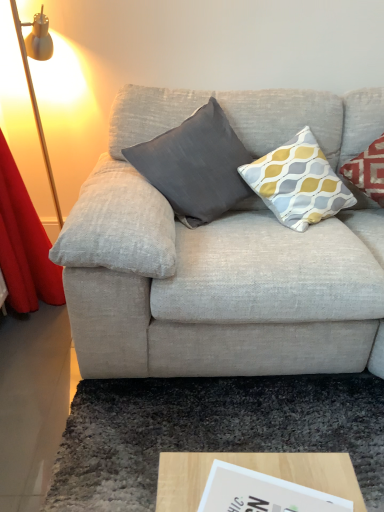
Locate an element on the screen. yellow-grey-patterned cushion at upper right, which is counted as the 1th pillow, starting from the right is located at coordinates (298, 183).

Where is `dark gray shaggy rug at lower center`? dark gray shaggy rug at lower center is located at coordinates (210, 431).

This screenshot has height=512, width=384. Identify the location of wooden at lower center. (256, 470).

Identify the location of gold metallic floor lamp at left. The width and height of the screenshot is (384, 512). (32, 81).

Can you tell me how much gold metallic floor lamp at left and dark gray shaggy rug at lower center differ in facing direction?

gold metallic floor lamp at left and dark gray shaggy rug at lower center are facing 178 degrees away from each other.

Which object is positioned more to the left, gold metallic floor lamp at left or dark gray shaggy rug at lower center?

Positioned to the left is gold metallic floor lamp at left.

Which point is more forward, [14,12] or [292,412]?

The point [292,412] is in front.

Can you confirm if gold metallic floor lamp at left is bigger than dark gray shaggy rug at lower center?

Correct, gold metallic floor lamp at left is larger in size than dark gray shaggy rug at lower center.

Considering the relative positions of dark gray fabric pillow at center, the 2th pillow from the right, and dark gray shaggy rug at lower center in the image provided, is dark gray fabric pillow at center, the 2th pillow from the right, to the right of dark gray shaggy rug at lower center from the viewer's perspective?

In fact, dark gray fabric pillow at center, the 2th pillow from the right, is to the left of dark gray shaggy rug at lower center.

Does dark gray fabric pillow at center, the 2th pillow from the right, turn towards dark gray shaggy rug at lower center?

No, dark gray fabric pillow at center, the 2th pillow from the right, is not oriented towards dark gray shaggy rug at lower center.

Is point (209, 125) positioned after point (264, 422)?

Yes, point (209, 125) is farther from viewer.

Considering the relative sizes of dark gray fabric pillow at center, the 1th pillow positioned from the left, and dark gray shaggy rug at lower center in the image provided, is dark gray fabric pillow at center, the 1th pillow positioned from the left, shorter than dark gray shaggy rug at lower center?

No, dark gray fabric pillow at center, the 1th pillow positioned from the left, is not shorter than dark gray shaggy rug at lower center.

From the image's perspective, is yellow-grey-patterned cushion at upper right, placed as the second pillow when sorted from left to right, over dark gray fabric pillow at center, the 2th pillow from the right?

No, from the image's perspective, yellow-grey-patterned cushion at upper right, placed as the second pillow when sorted from left to right, is not on top of dark gray fabric pillow at center, the 2th pillow from the right.

Which object is positioned more to the right, yellow-grey-patterned cushion at upper right, which is counted as the 1th pillow, starting from the right, or dark gray fabric pillow at center, the 2th pillow from the right?

yellow-grey-patterned cushion at upper right, which is counted as the 1th pillow, starting from the right, is more to the right.

Locate an element on the screen. pillow in front of the dark gray fabric pillow at center, the 2th pillow from the right is located at coordinates (298, 183).

From the picture: Considering their positions, is yellow-grey-patterned cushion at upper right, which is counted as the 1th pillow, starting from the right, located in front of or behind dark gray fabric pillow at center, the 1th pillow positioned from the left?

Visually, yellow-grey-patterned cushion at upper right, which is counted as the 1th pillow, starting from the right, is located in front of dark gray fabric pillow at center, the 1th pillow positioned from the left.

Based on the photo, what's the angular difference between dark gray fabric pillow at center, the 1th pillow positioned from the left, and wooden at lower center's facing directions?

The angle between the facing direction of dark gray fabric pillow at center, the 1th pillow positioned from the left, and the facing direction of wooden at lower center is 16.7 degrees.

Choose the correct answer: Is dark gray fabric pillow at center, the 1th pillow positioned from the left, inside wooden at lower center or outside it?

dark gray fabric pillow at center, the 1th pillow positioned from the left, is spatially situated outside wooden at lower center.

From a real-world perspective, between dark gray fabric pillow at center, the 1th pillow positioned from the left, and wooden at lower center, who is vertically higher?

dark gray fabric pillow at center, the 1th pillow positioned from the left.

Consider the image. Which object is wider, dark gray fabric pillow at center, the 1th pillow positioned from the left, or wooden at lower center?

dark gray fabric pillow at center, the 1th pillow positioned from the left, is wider.

Which is more distant, [36,37] or [207,152]?

The point [36,37] is farther.

What are the coordinates of `table lamp in front of the dark gray fabric pillow at center, the 2th pillow from the right` in the screenshot? It's located at coord(32,81).

In the image, is gold metallic floor lamp at left positioned in front of or behind dark gray fabric pillow at center, the 1th pillow positioned from the left?

Clearly, gold metallic floor lamp at left is in front of dark gray fabric pillow at center, the 1th pillow positioned from the left.

Does gold metallic floor lamp at left have a smaller size compared to dark gray fabric pillow at center, the 2th pillow from the right?

No, gold metallic floor lamp at left is not smaller than dark gray fabric pillow at center, the 2th pillow from the right.

Considering the sizes of objects dark gray shaggy rug at lower center and dark gray fabric pillow at center, the 1th pillow positioned from the left, in the image provided, who is wider, dark gray shaggy rug at lower center or dark gray fabric pillow at center, the 1th pillow positioned from the left,?

dark gray shaggy rug at lower center.

Considering the positions of objects dark gray shaggy rug at lower center and dark gray fabric pillow at center, the 2th pillow from the right, in the image provided, who is in front, dark gray shaggy rug at lower center or dark gray fabric pillow at center, the 2th pillow from the right,?

Positioned in front is dark gray shaggy rug at lower center.

Is point (187, 431) farther from camera compared to point (173, 173)?

No, (187, 431) is in front of (173, 173).

Identify the location of mat below the dark gray fabric pillow at center, the 1th pillow positioned from the left (from the image's perspective). This screenshot has width=384, height=512. (210, 431).

Considering the relative sizes of dark gray shaggy rug at lower center and wooden at lower center in the image provided, is dark gray shaggy rug at lower center taller than wooden at lower center?

No.

How much distance is there between dark gray shaggy rug at lower center and wooden at lower center?

They are 20.89 inches apart.

From a real-world perspective, is dark gray shaggy rug at lower center beneath wooden at lower center?

Yes, from a real-world perspective, dark gray shaggy rug at lower center is below wooden at lower center.

How different are the orientations of dark gray shaggy rug at lower center and wooden at lower center in degrees?

The angular difference between dark gray shaggy rug at lower center and wooden at lower center is 73.5 degrees.

Locate an element on the screen. This screenshot has width=384, height=512. table lamp in front of the dark gray shaggy rug at lower center is located at coordinates (32, 81).

Find the location of `mat on the right of dark gray fabric pillow at center, the 1th pillow positioned from the left`. mat on the right of dark gray fabric pillow at center, the 1th pillow positioned from the left is located at coordinates (210, 431).

Looking at the image, which one is located further to dark gray fabric pillow at center, the 1th pillow positioned from the left, yellow-grey-patterned cushion at upper right, which is counted as the 1th pillow, starting from the right, or wooden at lower center?

wooden at lower center lies further to dark gray fabric pillow at center, the 1th pillow positioned from the left, than the other object.

Looking at the image, which one is located further to wooden at lower center, dark gray shaggy rug at lower center or dark gray fabric pillow at center, the 1th pillow positioned from the left?

dark gray fabric pillow at center, the 1th pillow positioned from the left, is further to wooden at lower center.

Considering their positions, is wooden at lower center positioned further to gold metallic floor lamp at left than dark gray shaggy rug at lower center?

The object further to gold metallic floor lamp at left is wooden at lower center.

Considering their positions, is dark gray shaggy rug at lower center positioned further to dark gray fabric pillow at center, the 2th pillow from the right, than gold metallic floor lamp at left?

gold metallic floor lamp at left is further to dark gray fabric pillow at center, the 2th pillow from the right.

Based on their spatial positions, is wooden at lower center or yellow-grey-patterned cushion at upper right, placed as the second pillow when sorted from left to right, closer to dark gray shaggy rug at lower center?

wooden at lower center lies closer to dark gray shaggy rug at lower center than the other object.

Estimate the real-world distances between objects in this image. Which object is closer to gold metallic floor lamp at left, dark gray shaggy rug at lower center or dark gray fabric pillow at center, the 2th pillow from the right?

The object closer to gold metallic floor lamp at left is dark gray fabric pillow at center, the 2th pillow from the right.

Which object lies further to the anchor point dark gray fabric pillow at center, the 1th pillow positioned from the left, gold metallic floor lamp at left or yellow-grey-patterned cushion at upper right, placed as the second pillow when sorted from left to right?

gold metallic floor lamp at left.

Looking at the image, which one is located closer to dark gray shaggy rug at lower center, yellow-grey-patterned cushion at upper right, which is counted as the 1th pillow, starting from the right, or dark gray fabric pillow at center, the 2th pillow from the right?

yellow-grey-patterned cushion at upper right, which is counted as the 1th pillow, starting from the right.

Where is `pillow between gold metallic floor lamp at left and yellow-grey-patterned cushion at upper right, which is counted as the 1th pillow, starting from the right, in the horizontal direction`? The image size is (384, 512). pillow between gold metallic floor lamp at left and yellow-grey-patterned cushion at upper right, which is counted as the 1th pillow, starting from the right, in the horizontal direction is located at coordinates (195, 166).

Where is `coffee table that lies between dark gray fabric pillow at center, the 1th pillow positioned from the left, and dark gray shaggy rug at lower center from top to bottom`? The image size is (384, 512). coffee table that lies between dark gray fabric pillow at center, the 1th pillow positioned from the left, and dark gray shaggy rug at lower center from top to bottom is located at coordinates (256, 470).

This screenshot has height=512, width=384. Find the location of `table lamp between dark gray fabric pillow at center, the 1th pillow positioned from the left, and dark gray shaggy rug at lower center from top to bottom`. table lamp between dark gray fabric pillow at center, the 1th pillow positioned from the left, and dark gray shaggy rug at lower center from top to bottom is located at coordinates (32, 81).

This screenshot has width=384, height=512. I want to click on pillow between dark gray fabric pillow at center, the 2th pillow from the right, and dark gray shaggy rug at lower center from top to bottom, so click(298, 183).